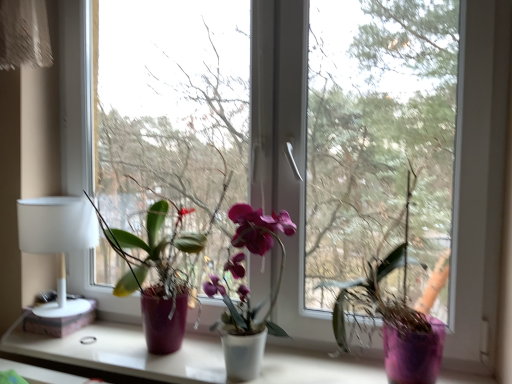
Where is `empty space that is ontop of white matte window sill at center`? The height and width of the screenshot is (384, 512). empty space that is ontop of white matte window sill at center is located at coordinates (147, 354).